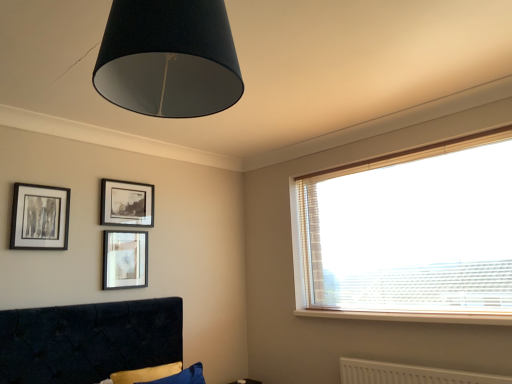
Question: From the image's perspective, relative to white textured radiator at lower right, is black glossy picture frame at upper center, acting as the 2th picture frame starting from the right, above or below?

Choices:
 (A) below
 (B) above

Answer: (B)

Question: Is black glossy picture frame at upper center, acting as the 2th picture frame starting from the right, in front of or behind white textured radiator at lower right in the image?

Choices:
 (A) behind
 (B) front

Answer: (A)

Question: Based on their relative distances, which object is nearer to the white textured radiator at lower right?

Choices:
 (A) white wood window sill at lower right
 (B) translucent wood blinds at upper right
 (C) matte black picture frame at upper left, the 1th picture frame in the left-to-right sequence
 (D) black fabric lampshade at upper center
 (E) white glossy table at lower center

Answer: (A)

Question: Which object is the closest to the white textured radiator at lower right?

Choices:
 (A) translucent wood blinds at upper right
 (B) white wood window sill at lower right
 (C) velvet dark blue bed at lower left
 (D) black fabric lampshade at upper center
 (E) white glossy table at lower center

Answer: (B)